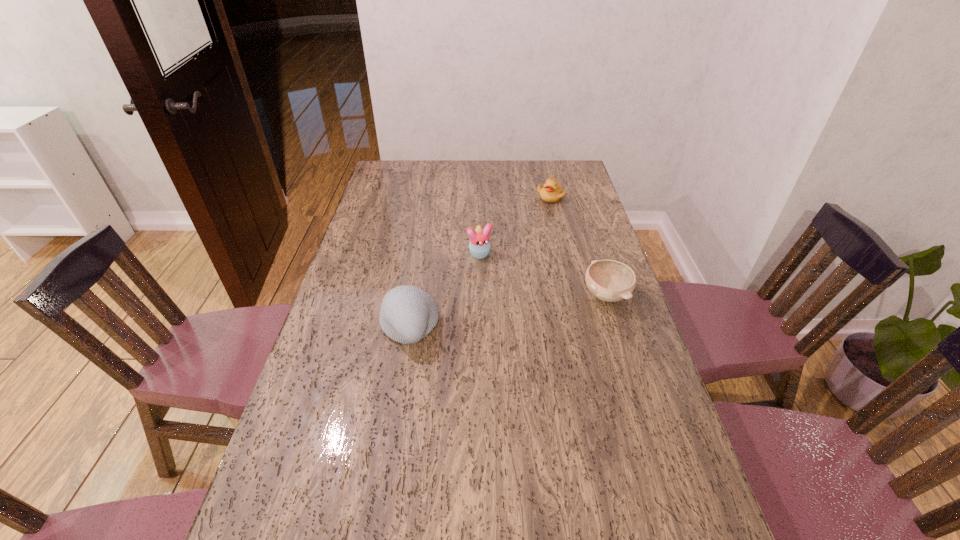
You are a GUI agent. You are given a task and a screenshot of the screen. Output one action in this format:
    pyautogui.click(x=<x>, y=<y>)
    Task: Click on the beanie
    Image resolution: width=960 pixels, height=540 pixels.
    Given the screenshot: What is the action you would take?
    pyautogui.click(x=408, y=314)

Find the location of a particular element. bowl is located at coordinates (608, 280).

Find the location of a particular element. duckling is located at coordinates (552, 192).

Identify the location of the second farthest object. (479, 245).

At what (x,y) coordinates should I click in order to perform the action: click on cupcake. Please return your answer as a coordinate pair (x, y). Looking at the image, I should click on (479, 245).

This screenshot has width=960, height=540. What are the coordinates of `blank space located on the front of the beanie` in the screenshot? It's located at (401, 374).

This screenshot has height=540, width=960. Identify the location of free location located on the left of the bowl. (514, 296).

Image resolution: width=960 pixels, height=540 pixels. I want to click on vacant region located on the front-facing side of the duckling, so click(x=527, y=250).

Find the location of a particular element. vacant space situated 0.400m on the front-facing side of the duckling is located at coordinates (520, 264).

In order to click on vacant space located on the front-facing side of the duckling in this screenshot , I will do `click(530, 244)`.